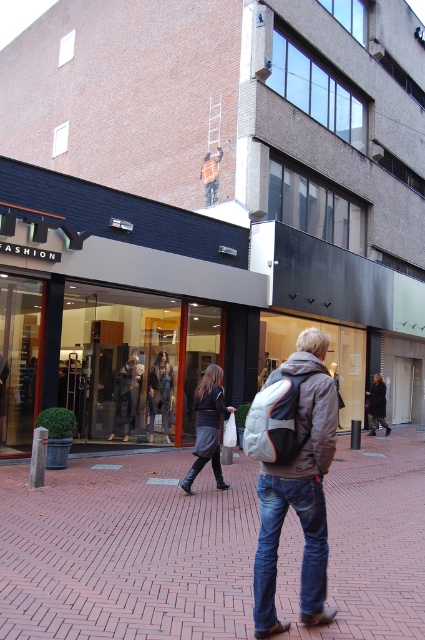
Question: Does blue denim jeans at lower right have a greater width compared to matte gray mannequin at center?

Choices:
 (A) yes
 (B) no

Answer: (B)

Question: Among these points, which one is farthest from the camera?

Choices:
 (A) (260, 499)
 (B) (380, 419)

Answer: (B)

Question: Is matte black glass mall at center closer to camera compared to dark gray skirt at center?

Choices:
 (A) no
 (B) yes

Answer: (A)

Question: Can you confirm if denim jacket at center is bigger than dark gray wool coat at center?

Choices:
 (A) no
 (B) yes

Answer: (A)

Question: Based on their relative distances, which object is nearer to the denim jacket at center?

Choices:
 (A) matte black glass mall at center
 (B) blue denim jeans at lower right

Answer: (B)

Question: Which point is farther from the camera taking this photo?

Choices:
 (A) (306, 589)
 (B) (323, 508)

Answer: (A)